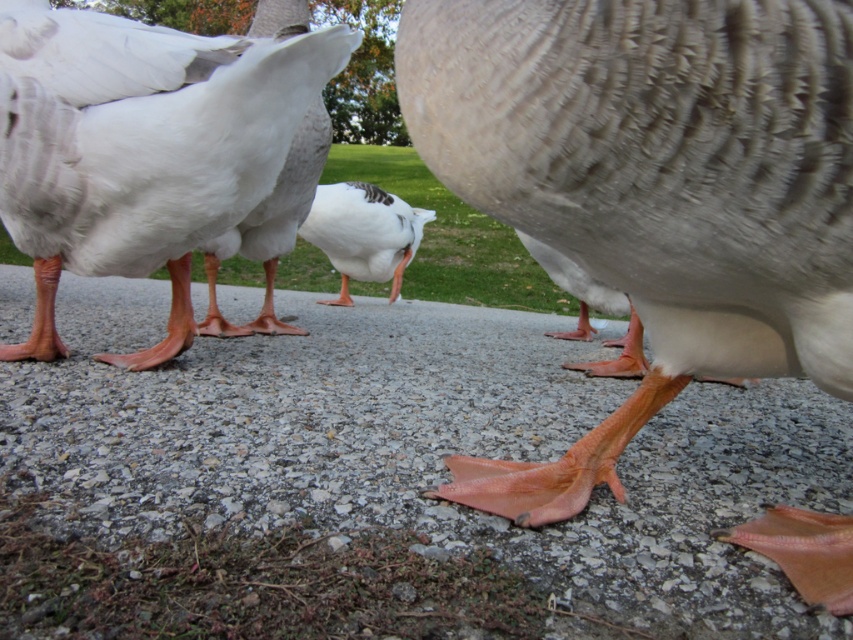
Question: Which of the following is the closest to the observer?

Choices:
 (A) orange rubber duck feet at center
 (B) matte white duck at lower left

Answer: (A)

Question: Where is orange rubber duck feet at center located in relation to white matte duck at center in the image?

Choices:
 (A) below
 (B) above

Answer: (A)

Question: Can you confirm if matte gray duck foot at center is positioned above matte white duck at lower left?

Choices:
 (A) yes
 (B) no

Answer: (B)

Question: Which of these objects is positioned closest to the orange rubber duck feet at center?

Choices:
 (A) matte gray duck foot at center
 (B) matte white duck at lower left

Answer: (B)

Question: Can you confirm if matte white duck at lower left is bigger than white matte duck at center?

Choices:
 (A) yes
 (B) no

Answer: (B)

Question: Among these objects, which one is nearest to the camera?

Choices:
 (A) matte white duck at lower left
 (B) orange rubber duck feet at center

Answer: (B)